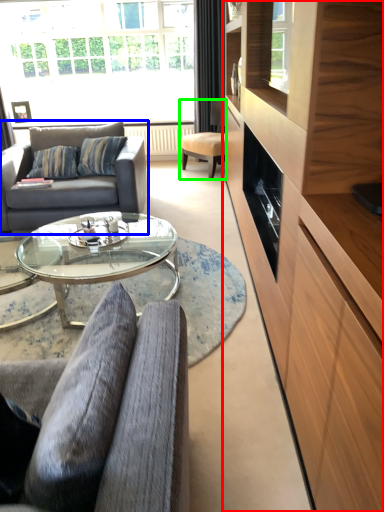
Question: Considering the real-world distances, which object is farthest from cabinetry (highlighted by a red box)? studio couch (highlighted by a blue box) or chair (highlighted by a green box)?

Choices:
 (A) studio couch
 (B) chair

Answer: (B)